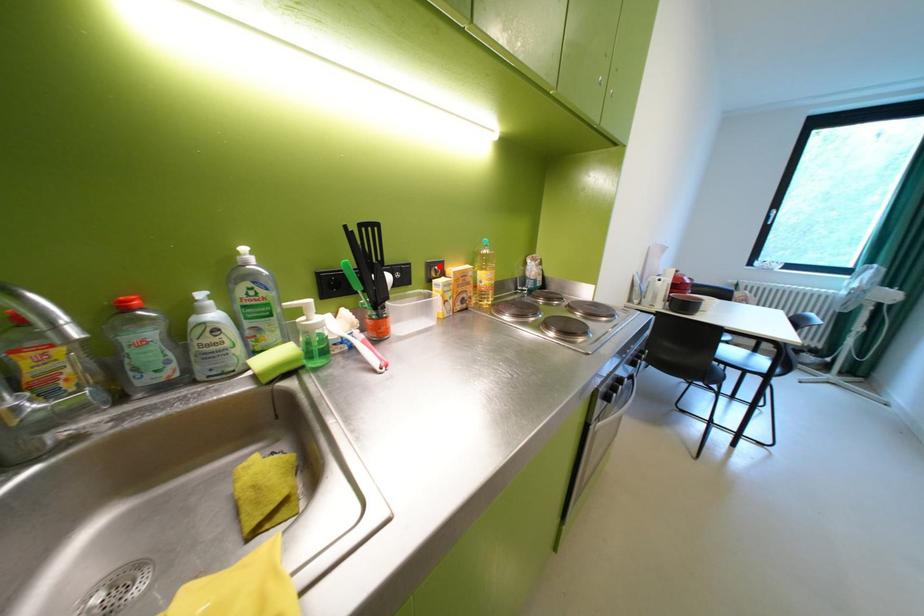
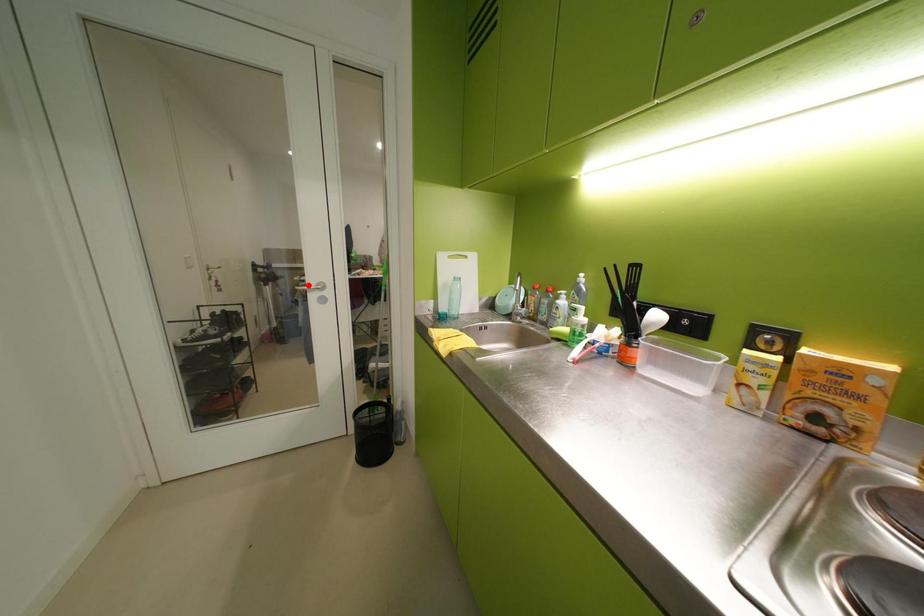
I am providing you with two images of the same scene from different viewpoints. A red point is marked on the first image and another point is marked on the second image. Do the highlighted points in image1 and image2 indicate the same real-world spot?

No